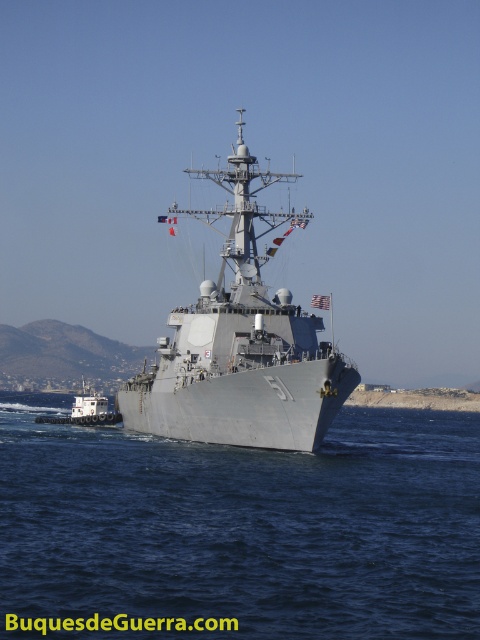
Identify the location of gray metallic water at center. The width and height of the screenshot is (480, 640). (240, 529).

Is point (112, 433) more distant than point (81, 410)?

No, it is in front of (81, 410).

Find the location of `gray metallic water at center`. gray metallic water at center is located at coordinates (240, 529).

Can you confirm if gray metallic warship at center is taller than white matte tugboat at lower left?

Yes.

Who is higher up, gray metallic warship at center or white matte tugboat at lower left?

gray metallic warship at center is higher up.

Is point (276, 433) behind point (87, 406)?

That is False.

You are a GUI agent. You are given a task and a screenshot of the screen. Output one action in this format:
    pyautogui.click(x=<x>, y=<y>)
    Task: Click on the gray metallic warship at center
    Image resolution: width=480 pixels, height=640 pixels.
    Given the screenshot: What is the action you would take?
    pyautogui.click(x=241, y=346)

Does gray metallic water at center have a lesser height compared to gray metallic warship at center?

Correct, gray metallic water at center is not as tall as gray metallic warship at center.

Who is positioned more to the left, gray metallic water at center or gray metallic warship at center?

From the viewer's perspective, gray metallic water at center appears more on the left side.

Is point (471, 592) behind point (175, 376)?

No, (471, 592) is in front of (175, 376).

You are a GUI agent. You are given a task and a screenshot of the screen. Output one action in this format:
    pyautogui.click(x=<x>, y=<y>)
    Task: Click on the gray metallic water at center
    
    Given the screenshot: What is the action you would take?
    pyautogui.click(x=240, y=529)